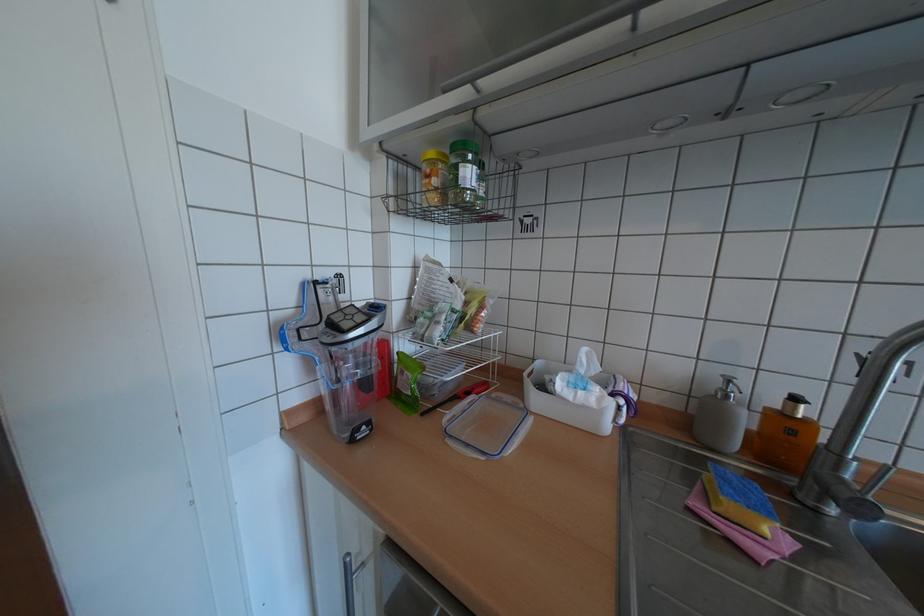
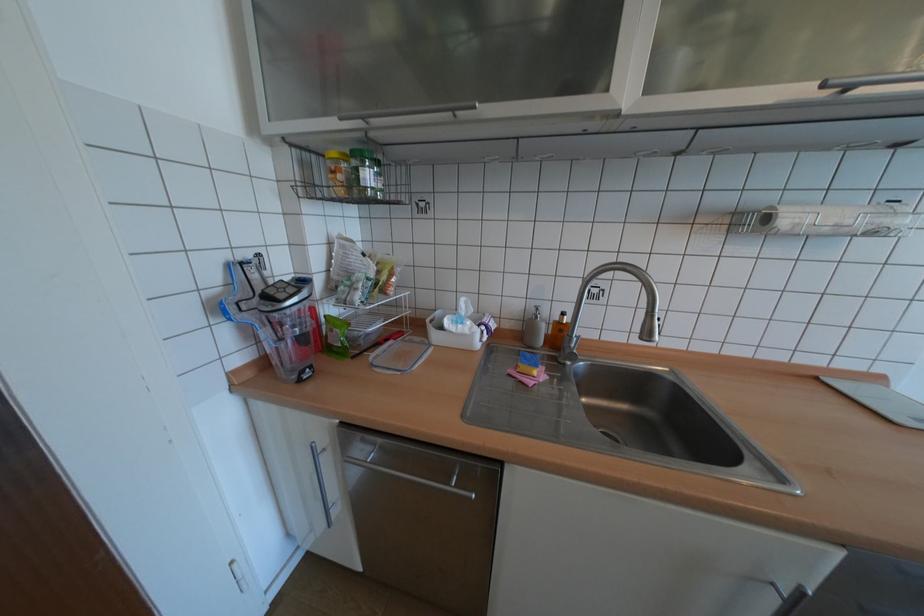
The point at (473, 177) is marked in the first image. Where is the corresponding point in the second image?

(373, 179)